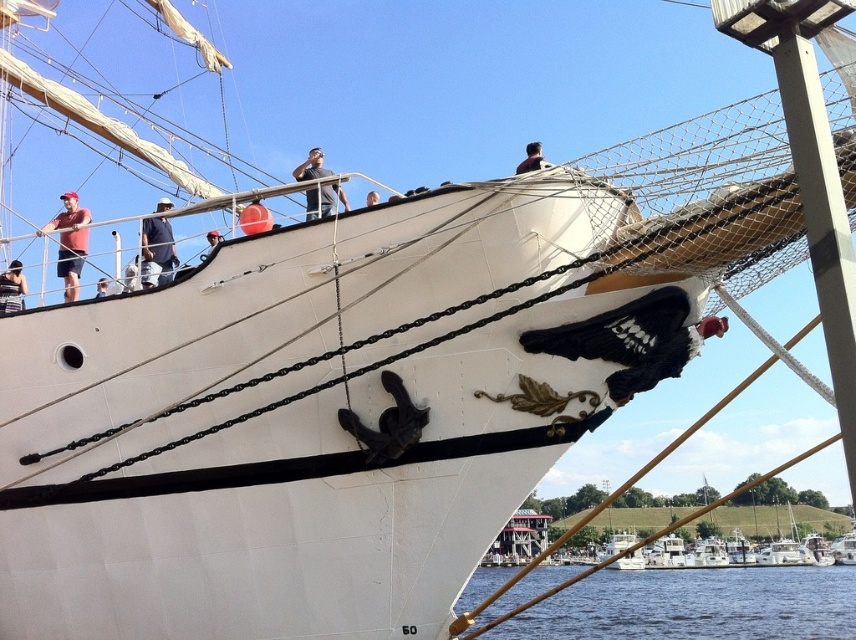
Question: Considering the relative positions of dark brown hair at upper center and light blue denim shirt at upper left in the image provided, where is dark brown hair at upper center located with respect to light blue denim shirt at upper left?

Choices:
 (A) below
 (B) above

Answer: (B)

Question: Does red helmet at upper center appear under light blue shirt at upper center?

Choices:
 (A) yes
 (B) no

Answer: (A)

Question: Which object appears closest to the camera in this image?

Choices:
 (A) transparent water at lower right
 (B) matte red shirt at upper left

Answer: (A)

Question: Is gray matte shirt at upper center positioned at the back of light blue shirt at upper center?

Choices:
 (A) no
 (B) yes

Answer: (A)

Question: Which point is closer to the camera taking this photo?

Choices:
 (A) (531, 164)
 (B) (217, 237)

Answer: (A)

Question: Among these objects, which one is farthest from the camera?

Choices:
 (A) gray matte shirt at upper center
 (B) transparent water at lower right
 (C) red helmet at upper center

Answer: (A)